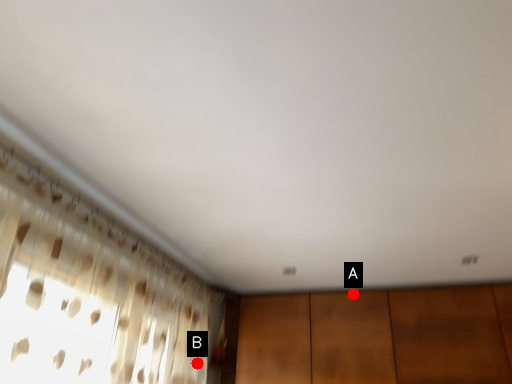
Question: Two points are circled on the image, labeled by A and B beside each circle. Among these points, which one is nearest to the camera?

Choices:
 (A) A is closer
 (B) B is closer

Answer: (B)